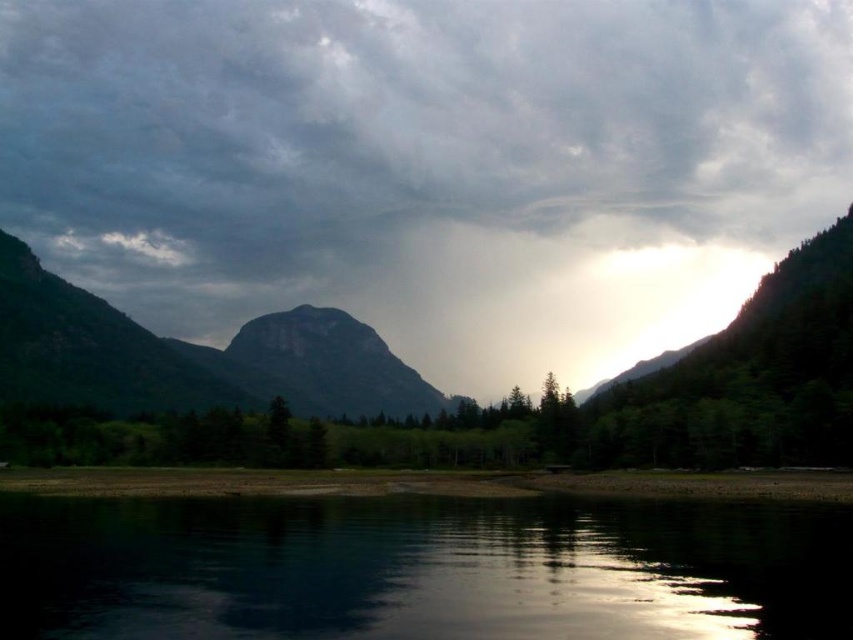
Does black reflective water at lower center appear on the right side of rugged stone mountain at center?

Correct, you'll find black reflective water at lower center to the right of rugged stone mountain at center.

Who is taller, black reflective water at lower center or rugged stone mountain at center?

Standing taller between the two is rugged stone mountain at center.

What do you see at coordinates (421, 568) in the screenshot?
I see `black reflective water at lower center` at bounding box center [421, 568].

The height and width of the screenshot is (640, 853). What are the coordinates of `black reflective water at lower center` in the screenshot? It's located at (421, 568).

Can you confirm if dark gray cloud at center is shorter than black reflective water at lower center?

Incorrect, dark gray cloud at center's height does not fall short of black reflective water at lower center's.

Between point (160, 259) and point (90, 506), which one is positioned behind?

Positioned behind is point (160, 259).

Where is `dark gray cloud at center`? This screenshot has width=853, height=640. dark gray cloud at center is located at coordinates (428, 164).

From the picture: Can you confirm if dark gray cloud at center is taller than rugged stone mountain at center?

Yes.

Can you confirm if dark gray cloud at center is positioned below rugged stone mountain at center?

Incorrect, dark gray cloud at center is not positioned below rugged stone mountain at center.

Locate an element on the screen. The height and width of the screenshot is (640, 853). dark gray cloud at center is located at coordinates (428, 164).

The width and height of the screenshot is (853, 640). What are the coordinates of `dark gray cloud at center` in the screenshot? It's located at (428, 164).